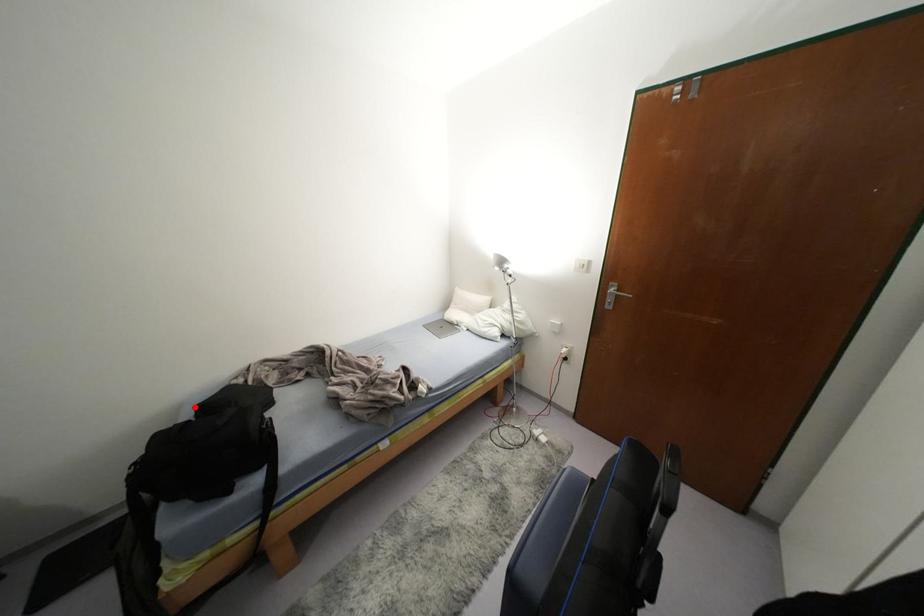
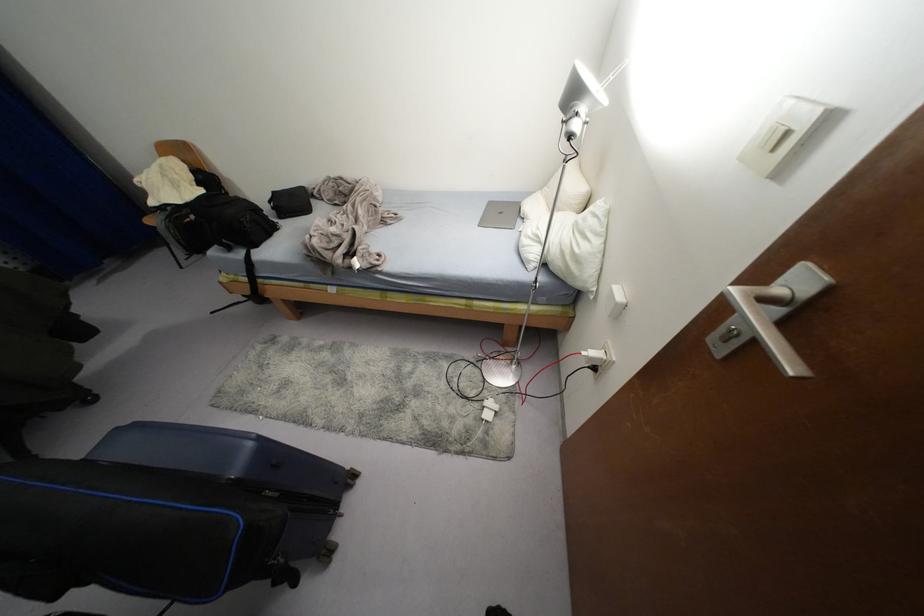
Question: A red point is marked in image1. In image2, is the corresponding 3D point closer to the camera or farther? Reply with the corresponding letter.

Choices:
 (A) The corresponding 3D point is closer.
 (B) The corresponding 3D point is farther.

Answer: (A)